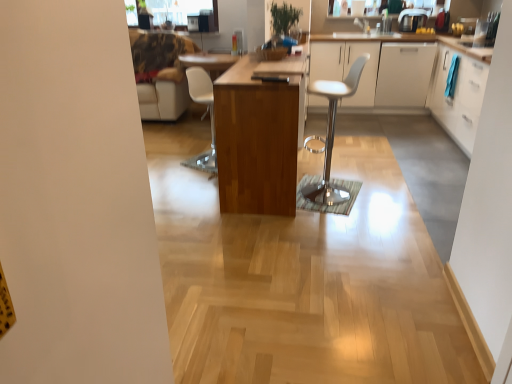
The height and width of the screenshot is (384, 512). Identify the location of vacant area that is in front of wooden table at center. (286, 239).